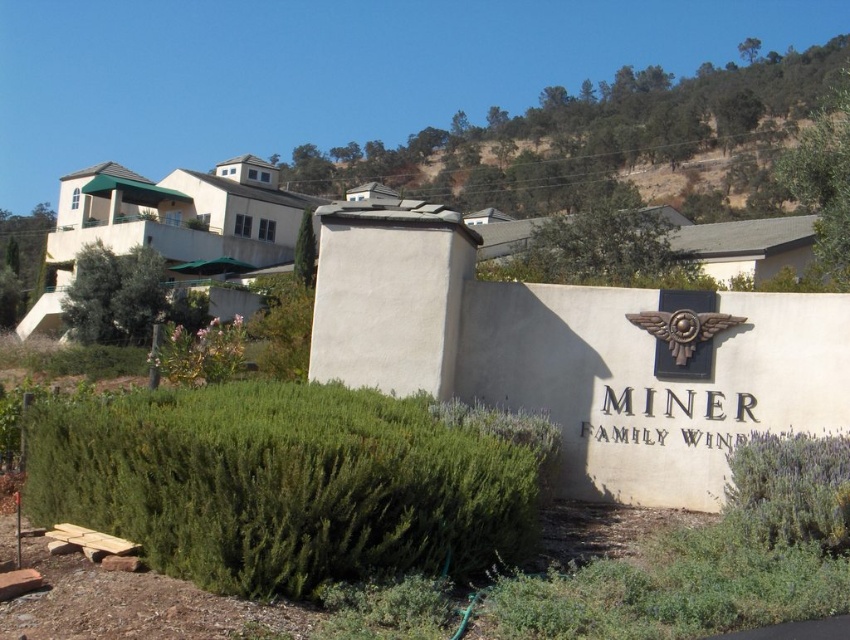
You are a gardener who needs to replace the green leafy hedge at lower center and the green leafy bush at left with new plants. Which of the two plants requires a smaller space to be replanted?

The green leafy hedge at lower center requires a smaller space to be replanted because it has a lesser width compared to the green leafy bush at left.

You are standing at the entrance of Miner Family Winery and want to take a photo of the stone wall with the name. To ensure the green leafy hedge at lower center doesn not block the view, where should you position yourself relative to the point marked at point (285, 483)?

To avoid blocking the view of the stone wall with the name, you should position yourself to the side or behind the point marked at point (285, 483) where the green leafy hedge at lower center is located.

You are a gardener who needs to trim the green leafy hedge at lower center and the green leafy hedge at lower right. Which hedge requires more time to trim based on their sizes?

The green leafy hedge at lower center requires more time to trim because it is bigger than the green leafy hedge at lower right.